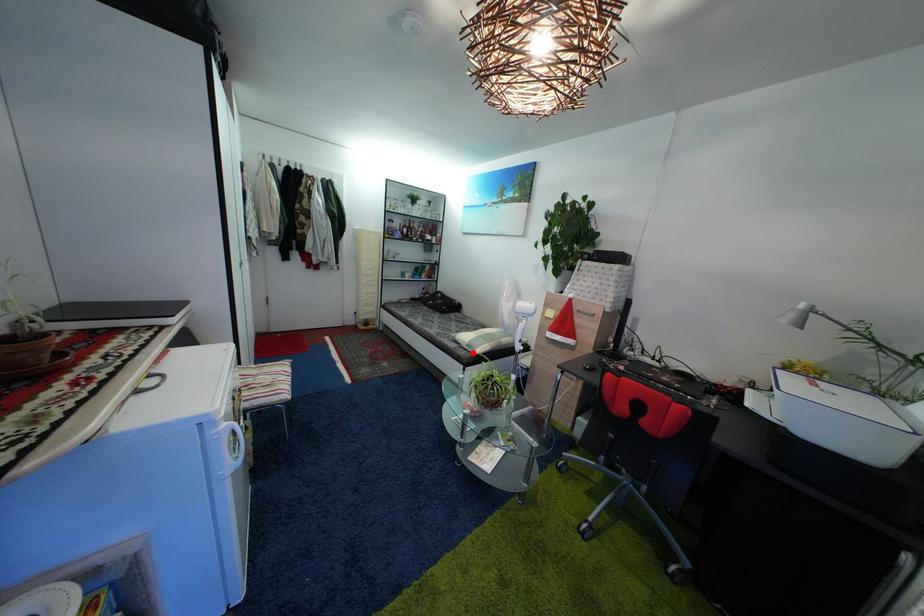
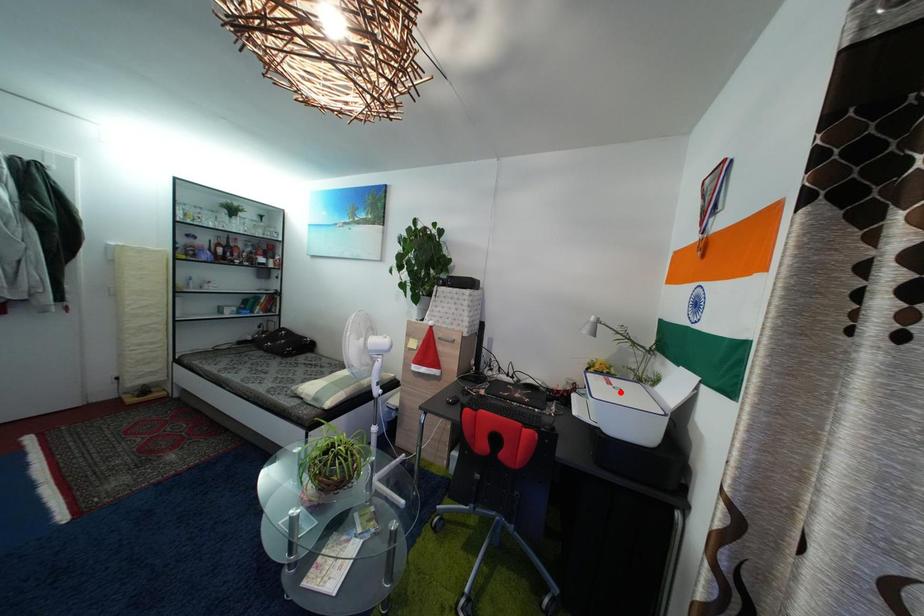
I am providing you with two images of the same scene from different viewpoints. A red point is marked on the first image and another point is marked on the second image. Is the marked point in image1 the same physical position as the marked point in image2?

No